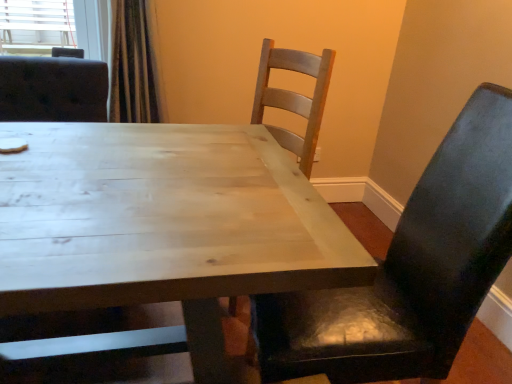
At what (x,y) coordinates should I click in order to perform the action: click on free spot above light wood table at center (from a real-world perspective). Please return your answer as a coordinate pair (x, y). Looking at the image, I should click on (142, 178).